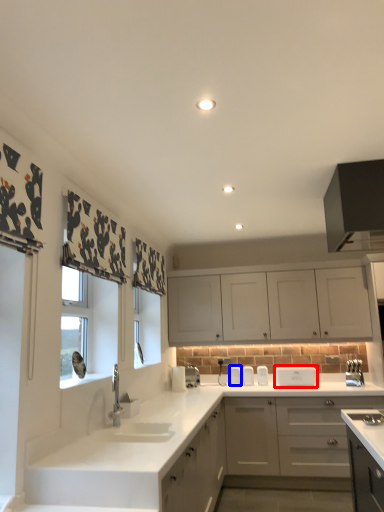
Question: Which point is closer to the camera, appliance (highlighted by a red box) or appliance (highlighted by a blue box)?

Choices:
 (A) appliance
 (B) appliance

Answer: (A)